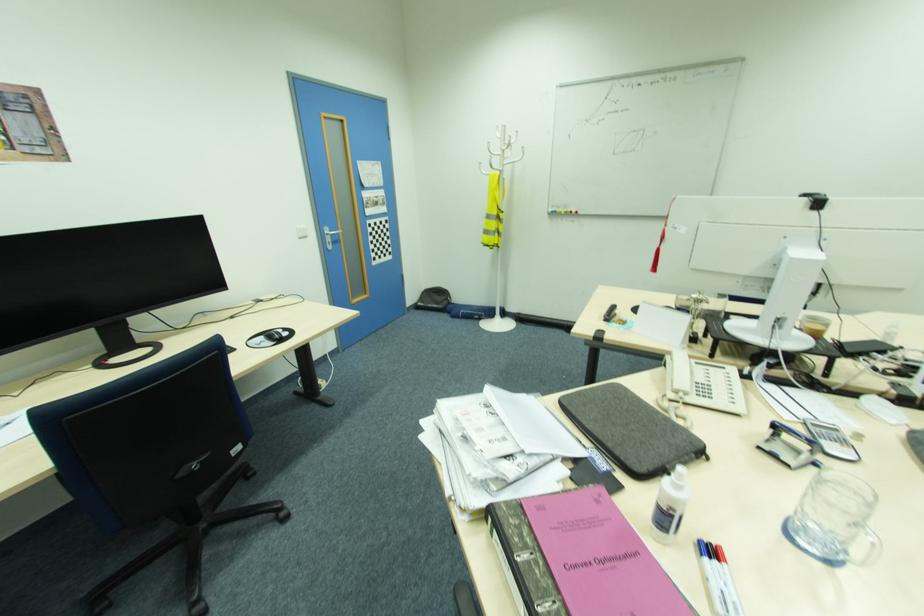
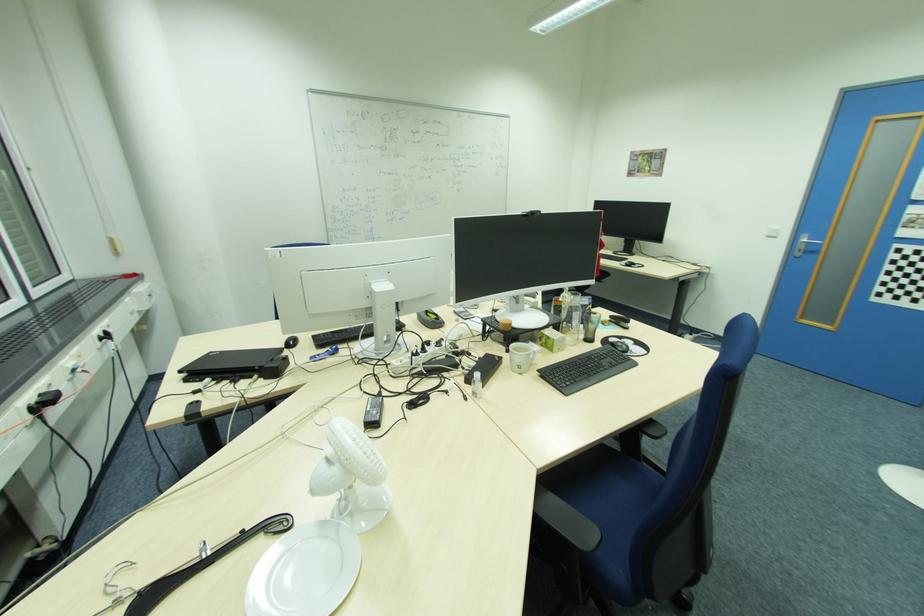
The point at (332, 243) is marked in the first image. Where is the corresponding point in the second image?

(804, 251)